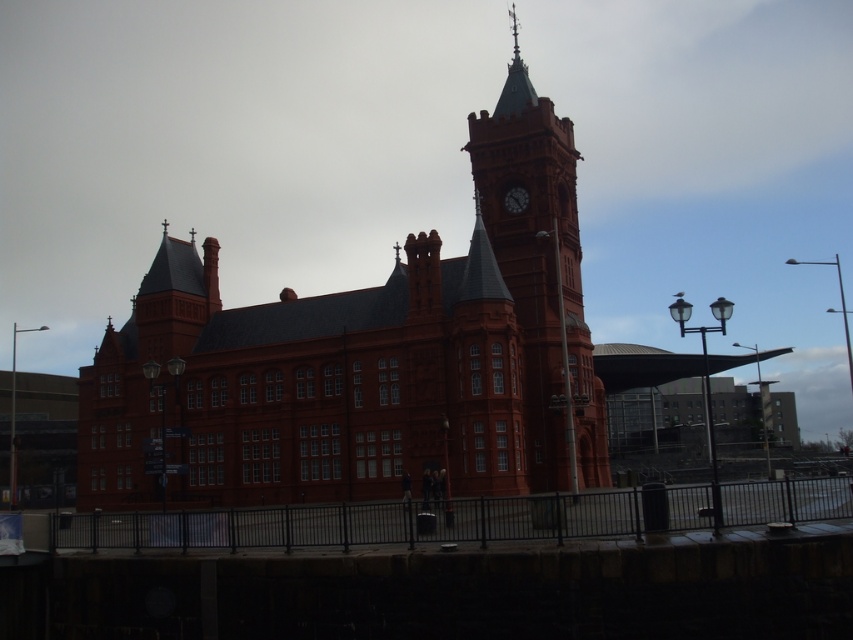
Who is taller, matte brick clock tower at center or dark brown wooden clock at upper center?

matte brick clock tower at center

Can you confirm if matte brick clock tower at center is positioned to the left of dark brown wooden clock at upper center?

Incorrect, matte brick clock tower at center is not on the left side of dark brown wooden clock at upper center.

Is point (532, 422) positioned before point (526, 202)?

Yes, it is.

Find the location of a particular element. Image resolution: width=853 pixels, height=640 pixels. matte brick clock tower at center is located at coordinates (538, 282).